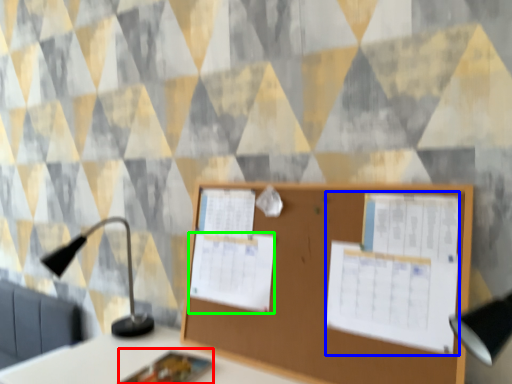
Question: Which object is positioned closest to notebook (highlighted by a red box)? Select from poster (highlighted by a blue box) and poster (highlighted by a green box).

Choices:
 (A) poster
 (B) poster

Answer: (B)